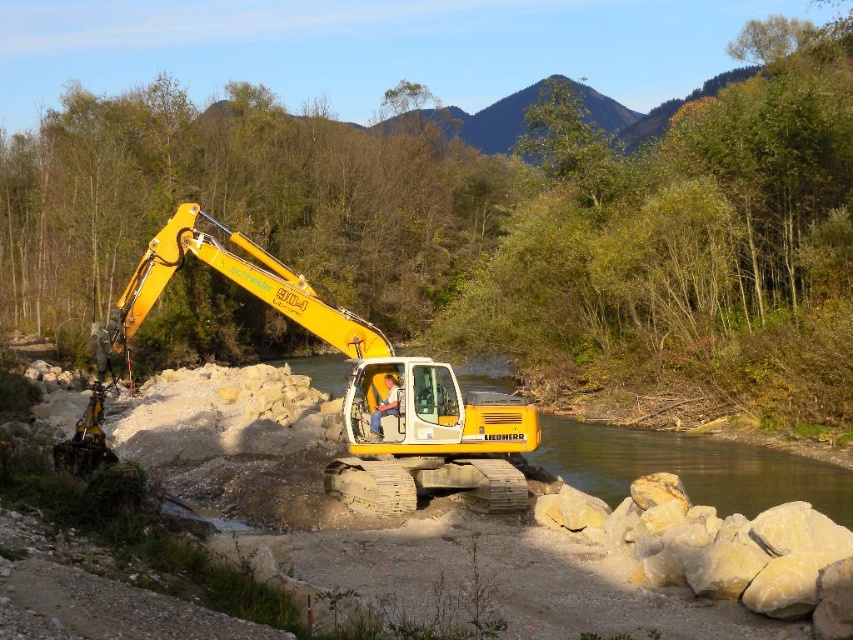
You are an environmental inspector checking the construction site. The excavator is operating near the water. According to safety regulations, heavy machinery must stay at least 5 meters away from water bodies to prevent contamination. Can you confirm if the yellow rubber excavator at center is violating this rule based on its position relative to the clear water at center?

The yellow rubber excavator at center is positioned over clear water at center, which means it is directly on the water and thus violating the safety regulation requiring a minimum distance of 5 meters.

You are an inspector standing at the edge of the construction site. You need to check the stability of the yellow rubber excavator at center and the depth of the clear water at center. Which object should you approach first without moving further into the site?

You should approach the yellow rubber excavator at center first because it is closer to you than the clear water at center, so you can check its stability without moving further into the site.

You are a safety inspector checking the construction site. You notice the yellow rubber excavator at center and the clear water at center. Which object is higher in elevation compared to the other?

The yellow rubber excavator at center is much taller than the clear water at center, so the yellow rubber excavator at center is higher in elevation compared to the clear water at center.